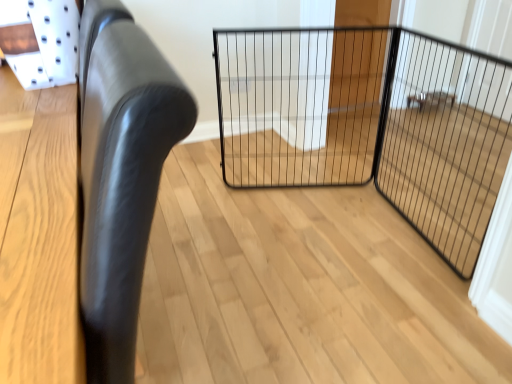
Question: From the image's perspective, is black leather chair at left positioned above or below black wire mesh gate at center?

Choices:
 (A) below
 (B) above

Answer: (A)

Question: From a real-world perspective, is black leather chair at left positioned above or below black wire mesh gate at center?

Choices:
 (A) below
 (B) above

Answer: (B)

Question: Which is nearer to the black wire mesh gate at center?

Choices:
 (A) black wire mesh screen door at center
 (B) black leather chair at left

Answer: (A)

Question: Estimate the real-world distances between objects in this image. Which object is closer to the black wire mesh screen door at center?

Choices:
 (A) black wire mesh gate at center
 (B) black leather chair at left

Answer: (A)